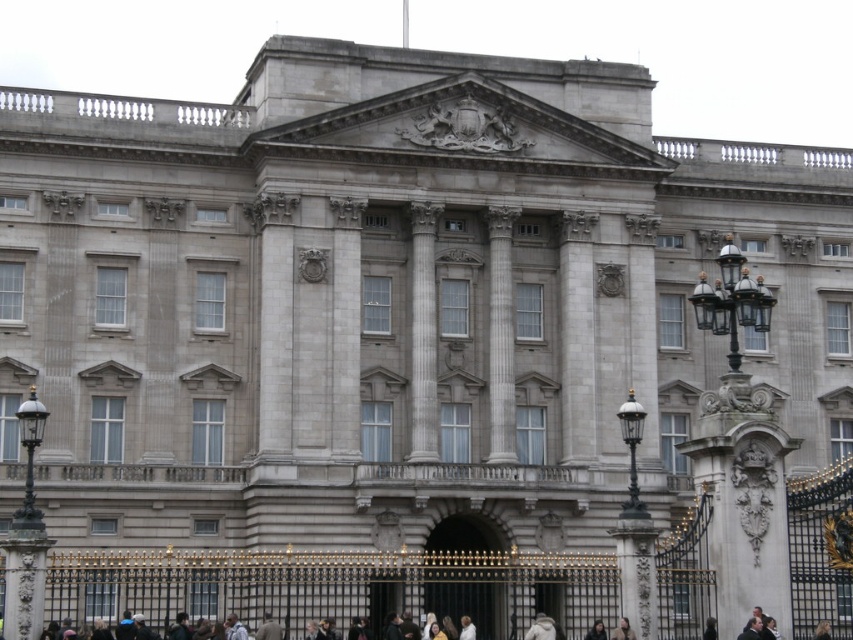
You are a tourist standing in front of Buckingham Palace. You see the gold ornate gate at center and the dark clothing at lower center. Which object is positioned to the right from your perspective?

The gold ornate gate at center is to the right of the dark clothing at lower center.

You are standing in front of Buckingham Palace and want to take a photo of the gold ornate gate at center. According to the coordinates provided, where should you position yourself to capture the gate in the center of your photo?

You should position yourself directly in front of the gold ornate gate at center, which is located at coordinates point (462, 572) to ensure it is centered in your photo.